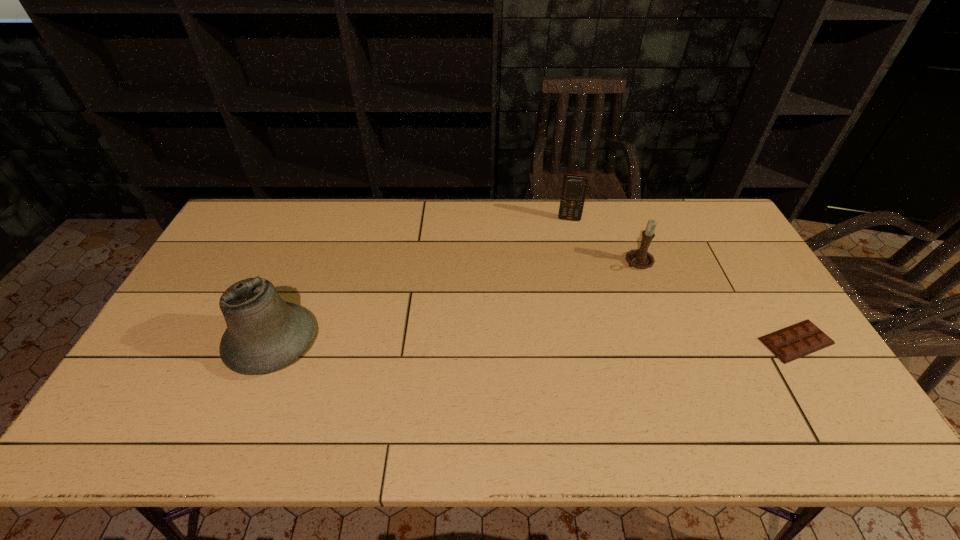
In order to click on vacant space located 0.250m on the side of the third object from left to right with the handle in this screenshot , I will do point(576,307).

You are a GUI agent. You are given a task and a screenshot of the screen. Output one action in this format:
    pyautogui.click(x=<x>, y=<y>)
    Task: Click on the vacant space positioned 0.390m on the side of the third object from left to right with the handle
    Image resolution: width=960 pixels, height=540 pixels.
    Given the screenshot: What is the action you would take?
    pyautogui.click(x=541, y=330)

Locate an element on the screen. This screenshot has height=540, width=960. free space located on the side of the third object from left to right with the handle is located at coordinates (603, 288).

Where is `free space located on the screen of the farthest object`? free space located on the screen of the farthest object is located at coordinates (564, 277).

In order to click on free space located on the screen of the farthest object in this screenshot , I will do `click(564, 266)`.

This screenshot has height=540, width=960. What are the coordinates of `vacant space located on the screen of the farthest object` in the screenshot? It's located at (565, 258).

You are a GUI agent. You are given a task and a screenshot of the screen. Output one action in this format:
    pyautogui.click(x=<x>, y=<y>)
    Task: Click on the object that is at the far edge
    The height and width of the screenshot is (540, 960).
    Given the screenshot: What is the action you would take?
    pyautogui.click(x=574, y=188)

Identify the location of object at the near edge. The height and width of the screenshot is (540, 960). (264, 333).

The image size is (960, 540). In order to click on object present at the right edge in this screenshot , I will do `click(793, 342)`.

Identify the location of free location at the far edge. This screenshot has height=540, width=960. (478, 224).